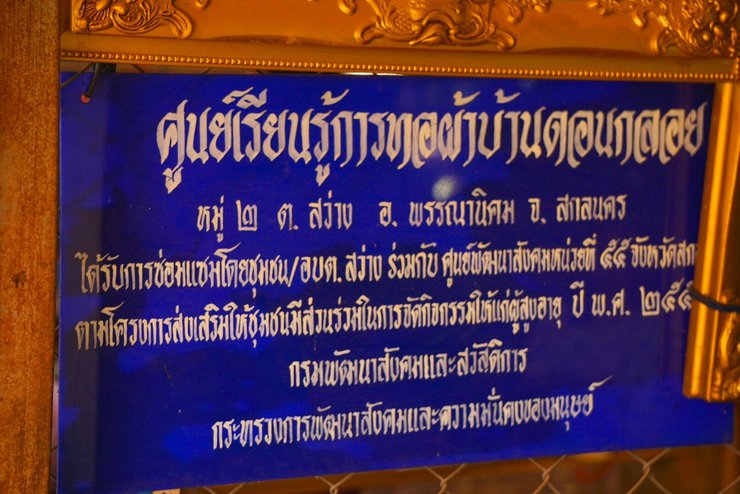
Identify the location of canvas. (481, 30).